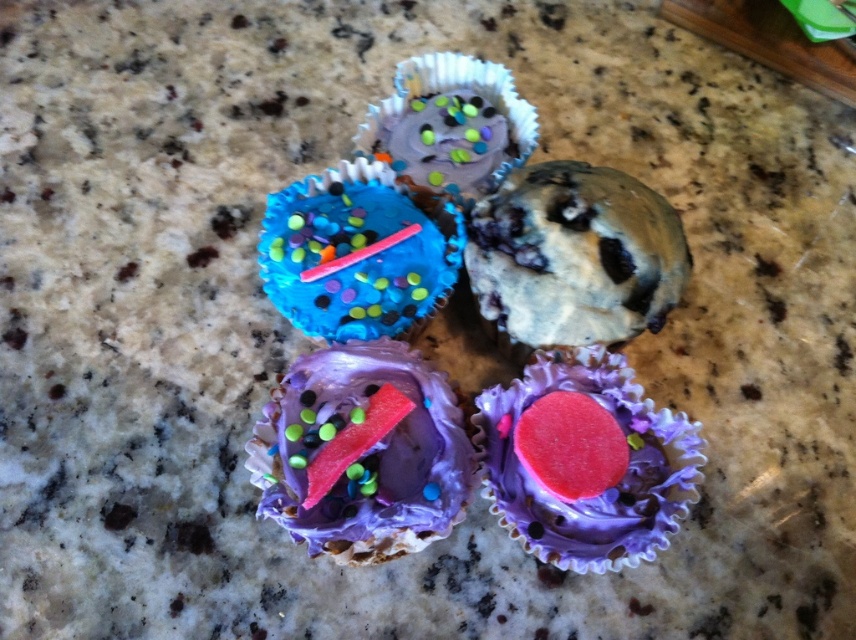
You are a baker who needs to place a new cupcake exactly halfway between the chocolate chip cookie dough at upper center and the purple frosted cupcake with sprinkles at upper center. What distance should you maintain from each object to ensure it is placed correctly?

The chocolate chip cookie dough at upper center is 17.19 centimeters away from the purple frosted cupcake with sprinkles at upper center. To place the new cupcake halfway between them, it should be placed 8.595 centimeters away from each object.